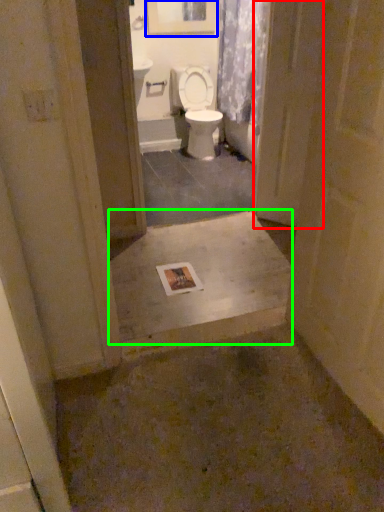
Question: Based on their relative distances, which object is farther from screen door (highlighted by a red box)? Choose from picture frame (highlighted by a blue box) and concrete (highlighted by a green box).

Choices:
 (A) picture frame
 (B) concrete

Answer: (A)